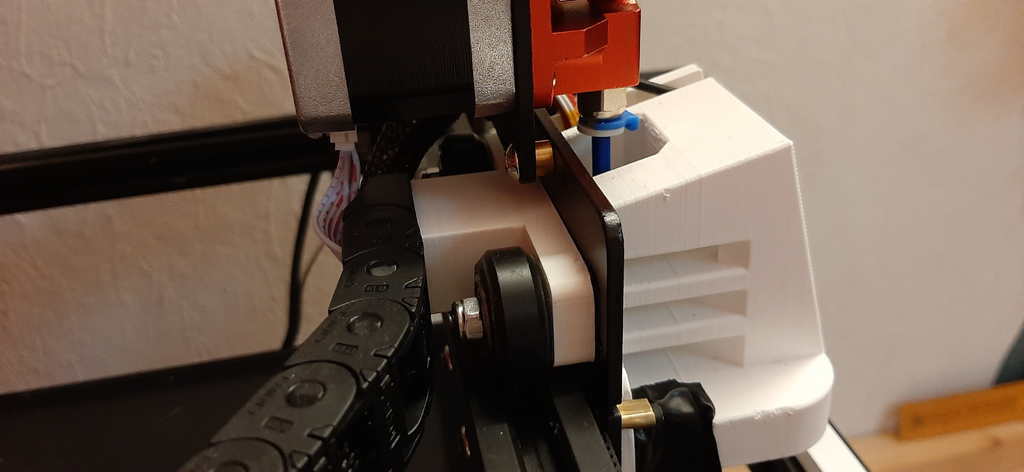
I want to click on wall, so click(857, 95).